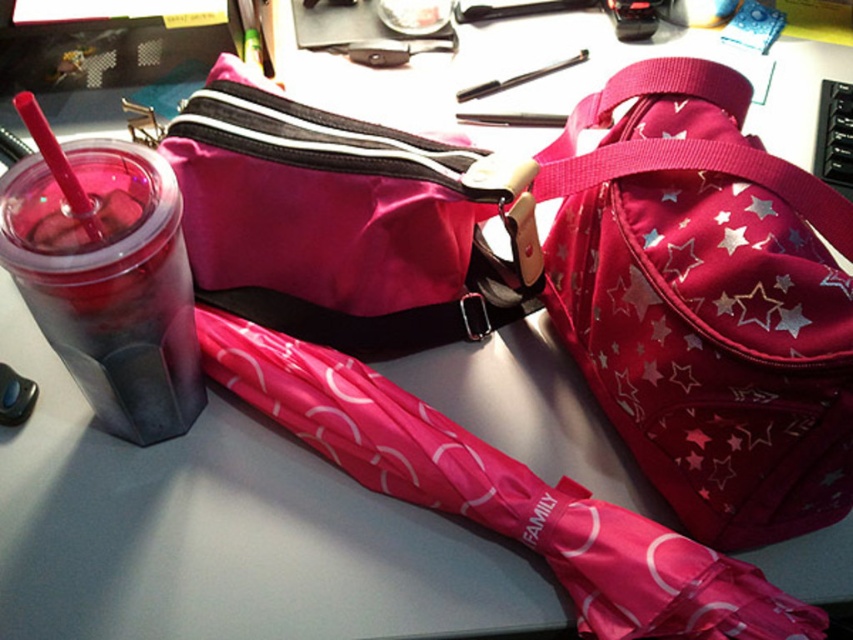
Is shiny pink fabric bag at upper right taller than metallic silver pen at upper center?

Yes, shiny pink fabric bag at upper right is taller than metallic silver pen at upper center.

Can you confirm if shiny pink fabric bag at upper right is positioned to the right of metallic silver pen at upper center?

Yes, shiny pink fabric bag at upper right is to the right of metallic silver pen at upper center.

Who is more distant from viewer, (675, 307) or (567, 60)?

Point (567, 60)

Locate an element on the screen. The height and width of the screenshot is (640, 853). shiny pink fabric bag at upper right is located at coordinates (705, 301).

Image resolution: width=853 pixels, height=640 pixels. Describe the element at coordinates (705, 301) in the screenshot. I see `shiny pink fabric bag at upper right` at that location.

Which is behind, point (677, 216) or point (96, 364)?

Positioned behind is point (96, 364).

This screenshot has height=640, width=853. What do you see at coordinates (705, 301) in the screenshot? I see `shiny pink fabric bag at upper right` at bounding box center [705, 301].

You are a GUI agent. You are given a task and a screenshot of the screen. Output one action in this format:
    pyautogui.click(x=<x>, y=<y>)
    Task: Click on the shiny pink fabric bag at upper right
    
    Given the screenshot: What is the action you would take?
    pyautogui.click(x=705, y=301)

Does point (10, 225) come farther from viewer compared to point (477, 86)?

No, (10, 225) is in front of (477, 86).

Can you confirm if transparent plastic cup with straw at left is taller than metallic silver pen at upper center?

Correct, transparent plastic cup with straw at left is much taller as metallic silver pen at upper center.

At what (x,y) coordinates should I click in order to perform the action: click on transparent plastic cup with straw at left. Please return your answer as a coordinate pair (x, y). This screenshot has width=853, height=640. Looking at the image, I should click on (x=109, y=284).

At what (x,y) coordinates should I click in order to perform the action: click on transparent plastic cup with straw at left. Please return your answer as a coordinate pair (x, y). This screenshot has height=640, width=853. Looking at the image, I should click on (109, 284).